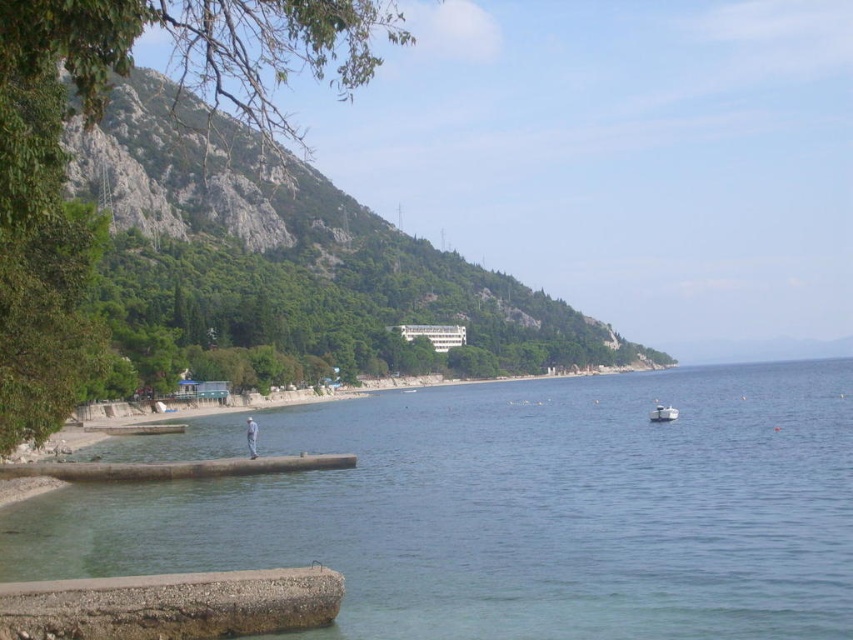
Find the location of `clear water at lower left`. clear water at lower left is located at coordinates coord(517,509).

Based on the photo, between green leafy hillside at upper left and light blue denim jeans at lower center, which one appears on the right side from the viewer's perspective?

From the viewer's perspective, green leafy hillside at upper left appears more on the right side.

The height and width of the screenshot is (640, 853). What do you see at coordinates (306, 234) in the screenshot?
I see `green leafy hillside at upper left` at bounding box center [306, 234].

Does point (543, 344) come farther from viewer compared to point (250, 417)?

Yes.

Where is `green leafy hillside at upper left`? This screenshot has height=640, width=853. green leafy hillside at upper left is located at coordinates (306, 234).

Can you confirm if white plastic boat at lower right is smaller than light blue denim jeans at lower center?

Correct, white plastic boat at lower right occupies less space than light blue denim jeans at lower center.

Can you confirm if white plastic boat at lower right is taller than light blue denim jeans at lower center?

No, white plastic boat at lower right is not taller than light blue denim jeans at lower center.

Does point (669, 406) lie behind point (247, 433)?

Yes, point (669, 406) is behind point (247, 433).

You are a GUI agent. You are given a task and a screenshot of the screen. Output one action in this format:
    pyautogui.click(x=<x>, y=<y>)
    Task: Click on the white plastic boat at lower right
    
    Given the screenshot: What is the action you would take?
    pyautogui.click(x=662, y=412)